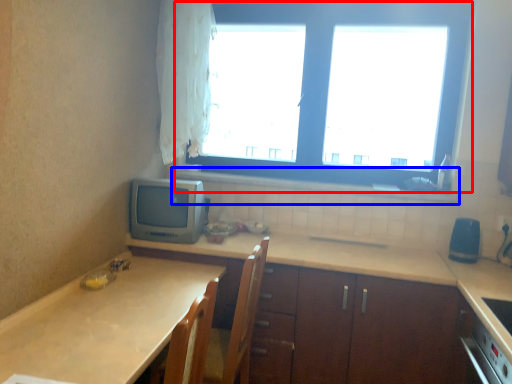
Question: Which of the following is the farthest to the observer, window (highlighted by a red box) or window sill (highlighted by a blue box)?

Choices:
 (A) window
 (B) window sill

Answer: (B)